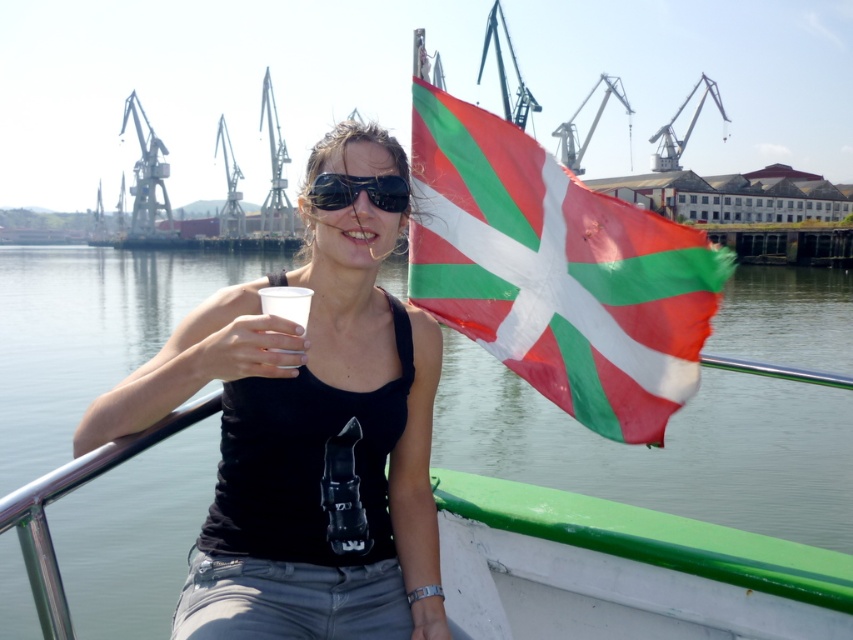
You are standing on the dock and see the point marked at coordinates (505, 236) on the boat. If you want to throw a lifebuoy to that point, will it reach there?

The distance between you and the point marked at coordinates (505, 236) is 20.88 meters. Whether the lifebuoy can reach depends on the throwing distance. If your throwing range exceeds 20.88 meters, it will reach. Otherwise, it won

You are a photographer on the boat and need to place a 10cm tall object between the black matte tank top at center and the clear plastic cup at center. Which object should you place it below to ensure it fits vertically?

The clear plastic cup at center is shorter than the black matte tank top at center. Place the 10cm tall object below the clear plastic cup at center to ensure it fits vertically.